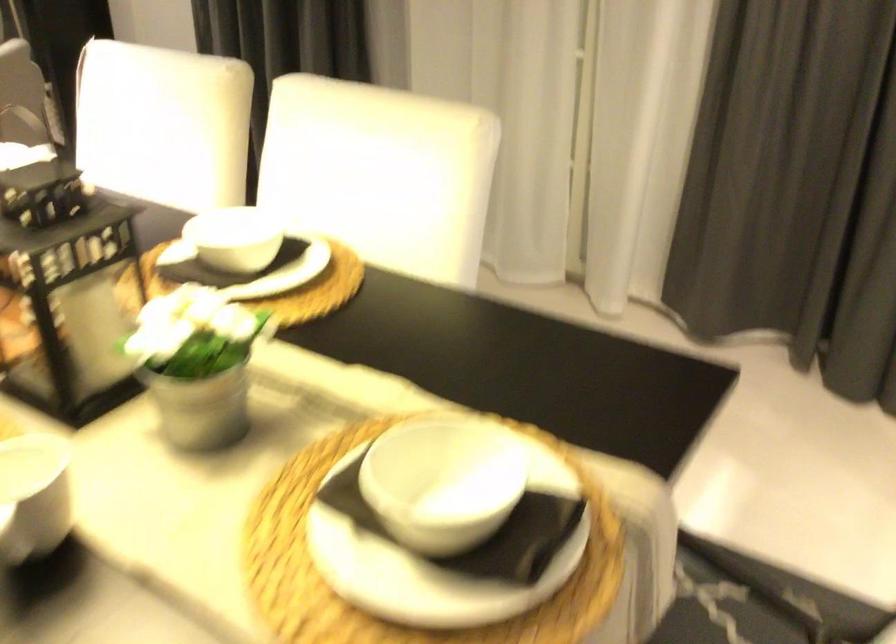
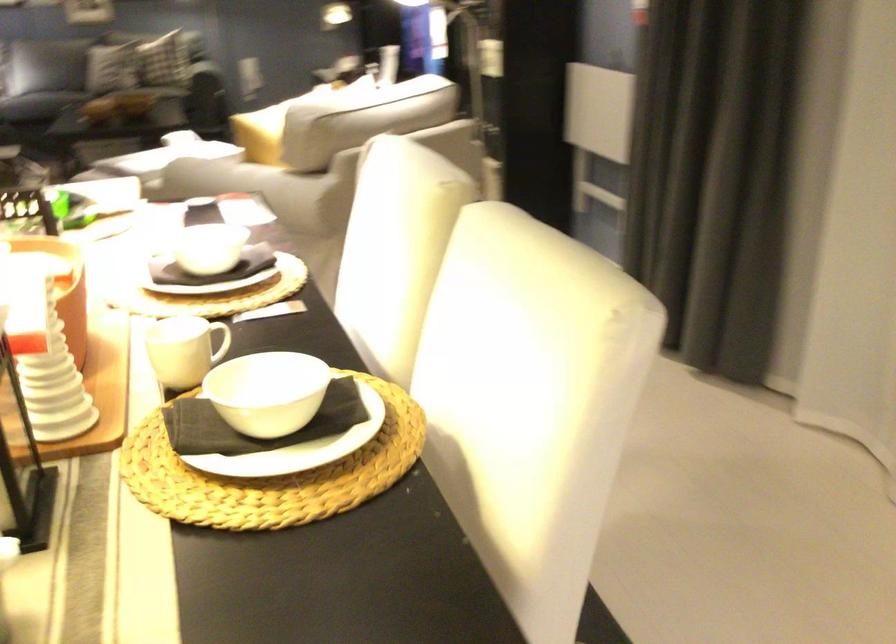
Question: The camera is either moving clockwise (left) or counter-clockwise (right) around the object. The first image is from the beginning of the video and the second image is from the end. Is the camera moving left or right when shooting the video?

Choices:
 (A) Left
 (B) Right

Answer: (B)